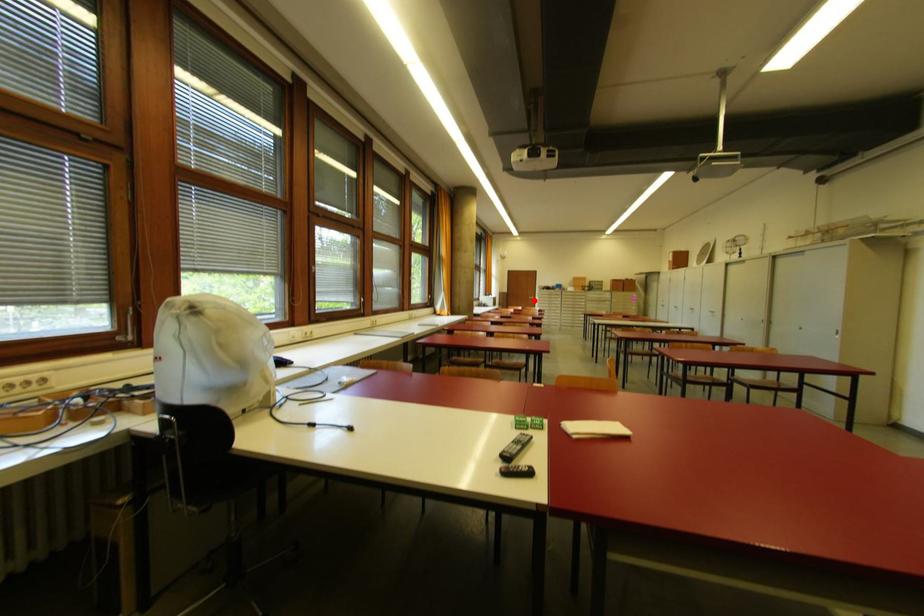
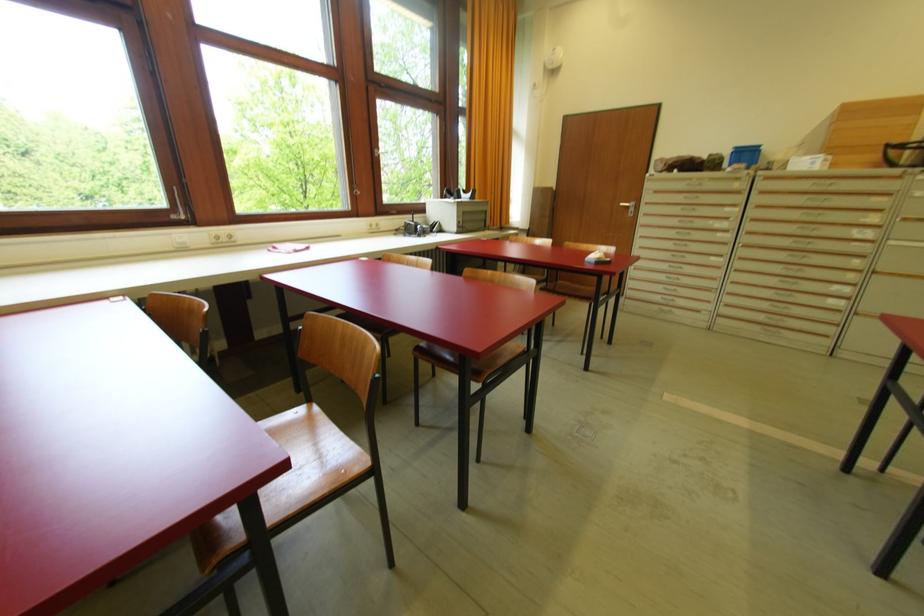
Question: I am providing you with two images of the same scene from different viewpoints. A red point is marked on the first image. At the location where the point appears in image 1, is it still visible in image 2?

Choices:
 (A) Yes
 (B) No

Answer: (A)